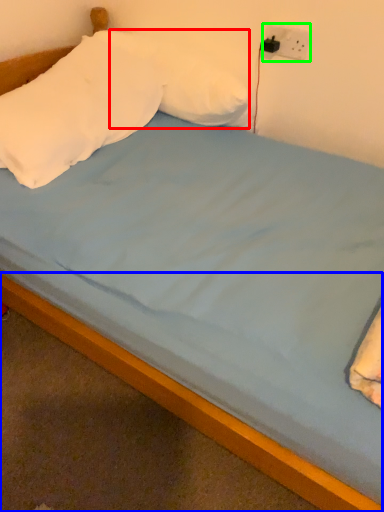
Question: Which object is positioned closest to pillow (highlighted by a red box)? Select from bed frame (highlighted by a blue box) and electric outlet (highlighted by a green box).

Choices:
 (A) bed frame
 (B) electric outlet

Answer: (B)